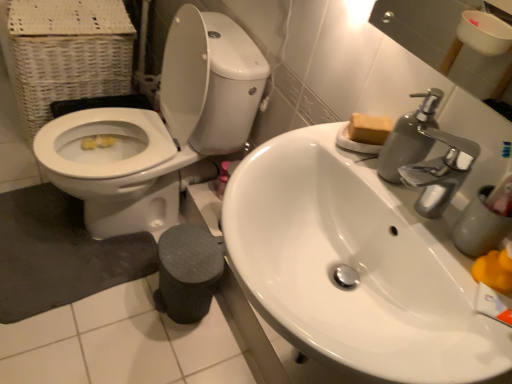
The image size is (512, 384). I want to click on vacant space in front of white glossy toilet at left, so click(117, 339).